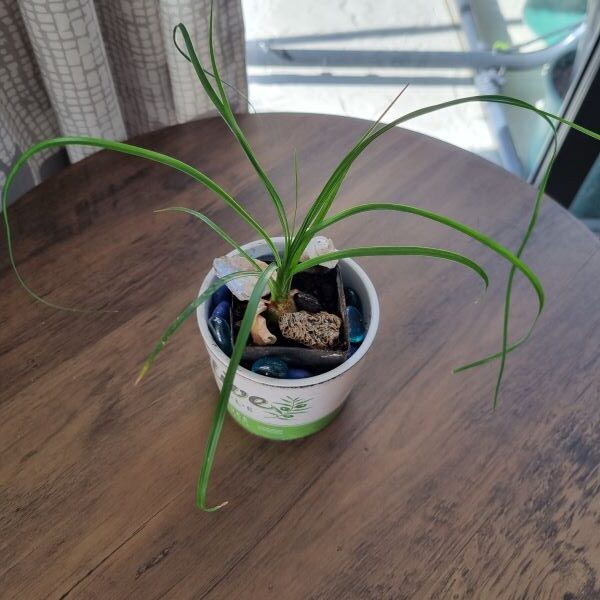
The width and height of the screenshot is (600, 600). Find the location of `window`. window is located at coordinates (395, 48).